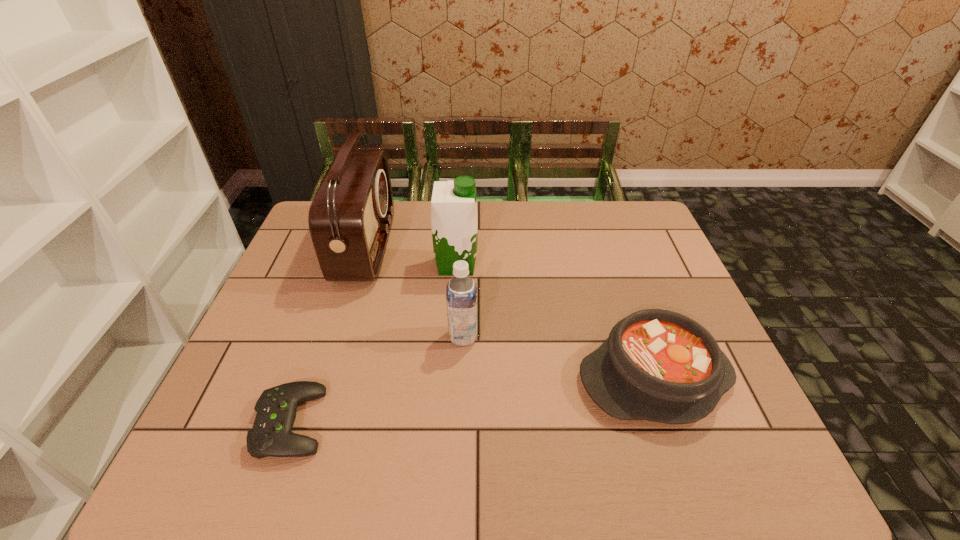
Image resolution: width=960 pixels, height=540 pixels. I want to click on unoccupied area between the nearer soya milk and the shortest object, so click(x=377, y=380).

The width and height of the screenshot is (960, 540). I want to click on vacant area that lies between the shortest object and the shorter soya milk, so point(377,380).

In order to click on vacant area that lies between the shortest object and the radio receiver in this screenshot , I will do `click(328, 336)`.

Locate an element on the screen. The height and width of the screenshot is (540, 960). free point between the farther soya milk and the radio receiver is located at coordinates (411, 256).

This screenshot has width=960, height=540. What are the coordinates of `the closest object to the control` in the screenshot? It's located at (461, 293).

Where is `the fourth closest object relative to the radio receiver`? This screenshot has width=960, height=540. the fourth closest object relative to the radio receiver is located at coordinates (658, 365).

What are the coordinates of `vacant area that satisfies the following two spatial constraints: 1. on the label of the rightmost object; 2. on the right side of the third shortest object` in the screenshot? It's located at (462, 378).

Find the location of a particular element. vacant space that satisfies the following two spatial constraints: 1. on the back side of the second shortest object; 2. on the front-facing side of the fourth shortest object is located at coordinates (614, 265).

Find the location of `vacant space that satisfies the following two spatial constraints: 1. on the back side of the casserole; 2. on the left side of the shortest object`. vacant space that satisfies the following two spatial constraints: 1. on the back side of the casserole; 2. on the left side of the shortest object is located at coordinates (307, 378).

Locate an element on the screen. The height and width of the screenshot is (540, 960). free region that satisfies the following two spatial constraints: 1. on the label of the rightmost object; 2. on the right side of the third tallest object is located at coordinates (462, 378).